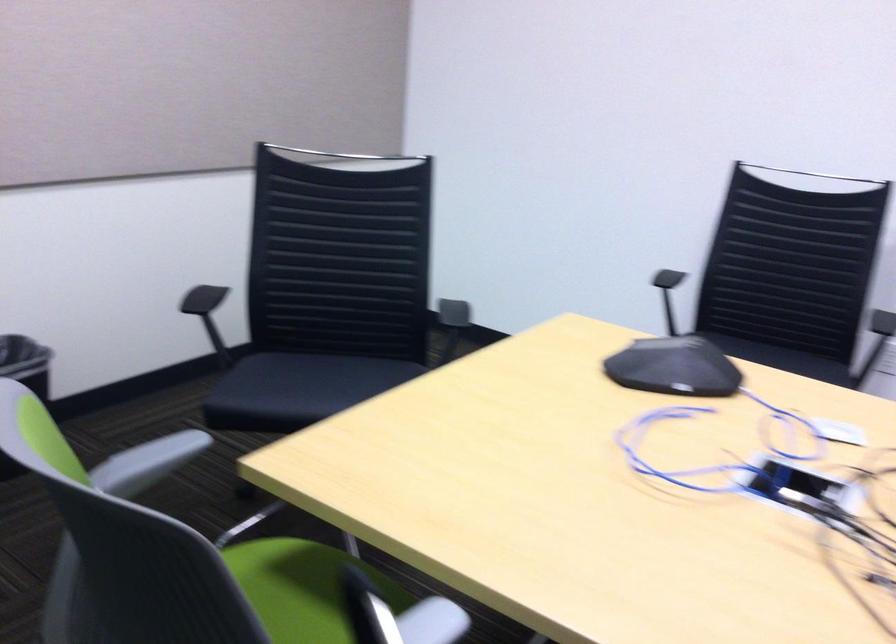
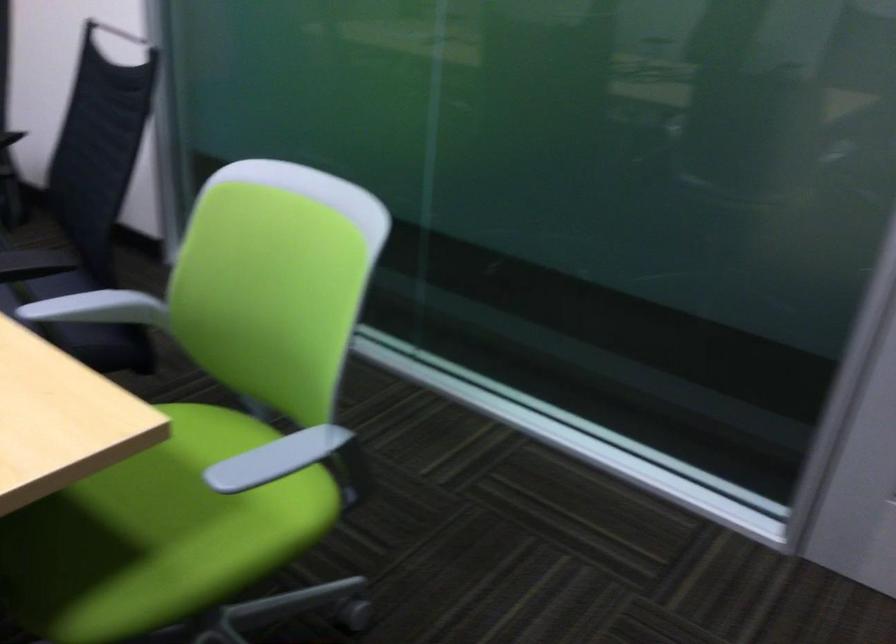
The point at (135, 446) is marked in the first image. Where is the corresponding point in the second image?

(276, 458)